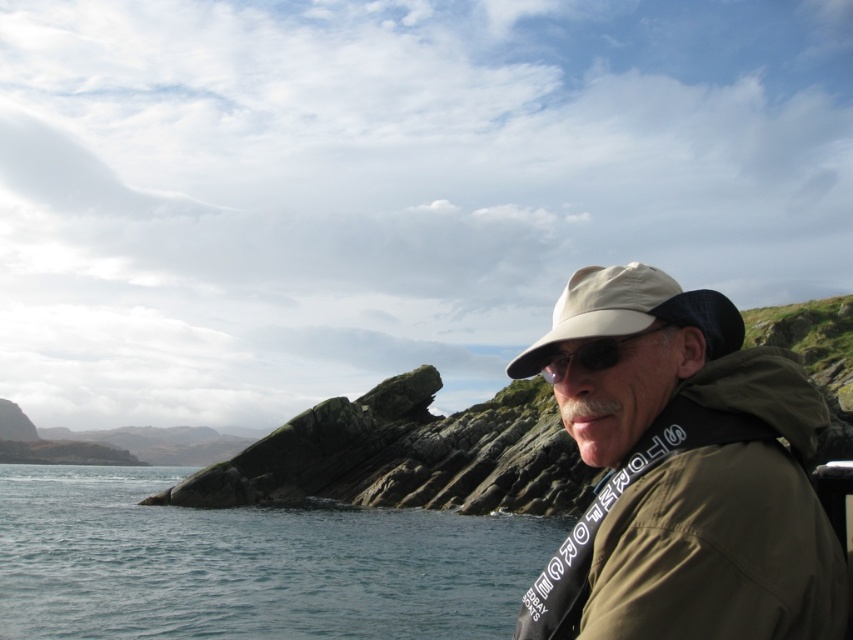
Question: Can you confirm if khaki fabric cap at upper right is wider than beige fabric baseball cap at center?

Choices:
 (A) no
 (B) yes

Answer: (B)

Question: Does blue water at lower left appear on the right side of black reflective sunglasses at center?

Choices:
 (A) no
 (B) yes

Answer: (A)

Question: Based on their relative distances, which object is nearer to the beige fabric baseball cap at center?

Choices:
 (A) khaki fabric cap at upper right
 (B) blue water at lower left

Answer: (A)

Question: Among these objects, which one is farthest from the camera?

Choices:
 (A) beige fabric baseball cap at center
 (B) black reflective sunglasses at center
 (C) khaki fabric cap at upper right
 (D) blue water at lower left

Answer: (D)

Question: Which object appears closest to the camera in this image?

Choices:
 (A) black reflective sunglasses at center
 (B) beige fabric baseball cap at center
 (C) khaki fabric cap at upper right

Answer: (C)

Question: Where is blue water at lower left located in relation to beige fabric baseball cap at center in the image?

Choices:
 (A) above
 (B) below

Answer: (B)